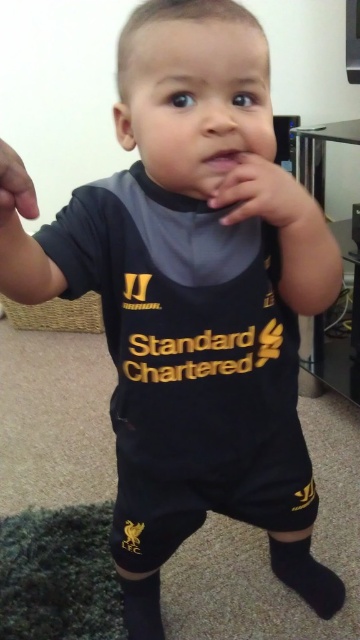
You are a photographer trying to capture the child in the image. You notice two points marked in the scene. The first point is at coordinate point [293,195] and the second is at point [6,214]. If you want to focus on the point that is closer to the camera, which coordinate should you choose?

Point [6,214] is closer to the camera since the description states that point [293,195] is behind point [6,214].